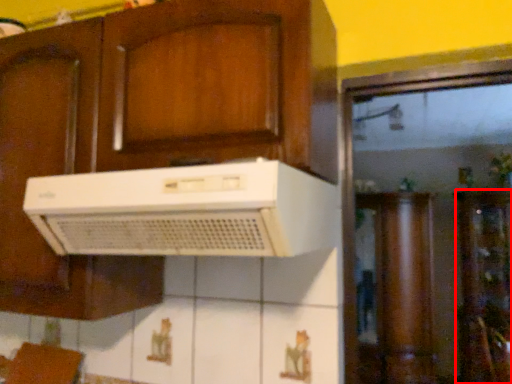
Question: From the image's perspective, what is the correct spatial positioning of cabinetry (annotated by the red box) in reference to home appliance?

Choices:
 (A) above
 (B) below

Answer: (B)